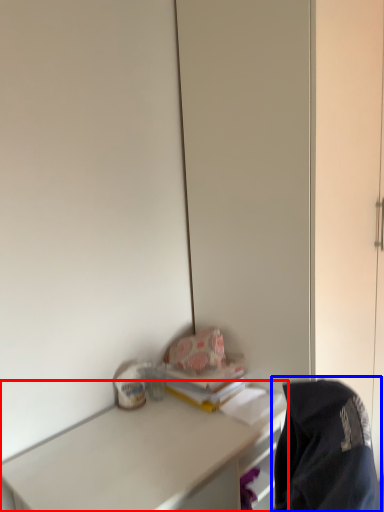
Question: Which of the following is the farthest to the observer, desk (highlighted by a red box) or jacket (highlighted by a blue box)?

Choices:
 (A) desk
 (B) jacket

Answer: (A)